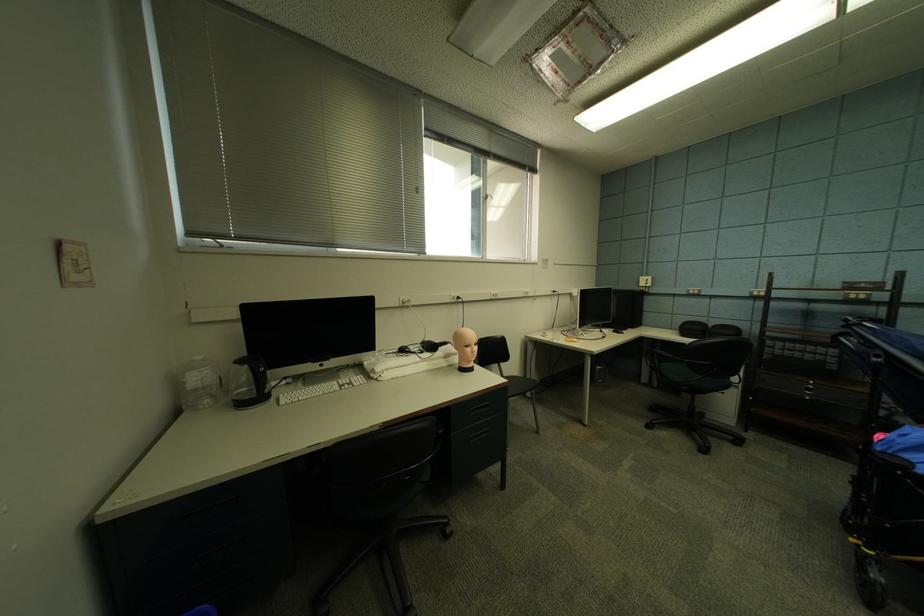
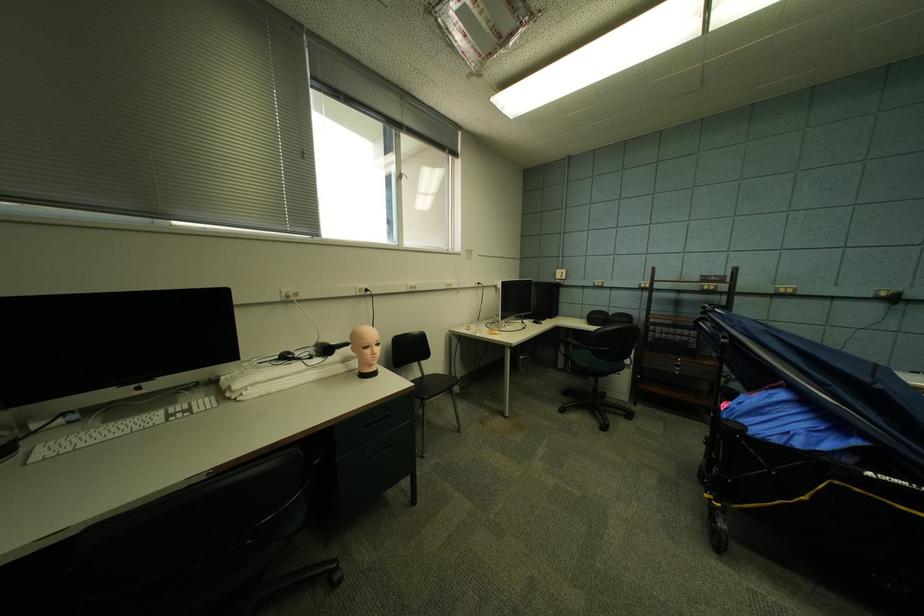
Question: The first image is from the beginning of the video and the second image is from the end. How did the camera likely rotate when shooting the video?

Choices:
 (A) Left
 (B) Right
 (C) Up
 (D) Down

Answer: (B)